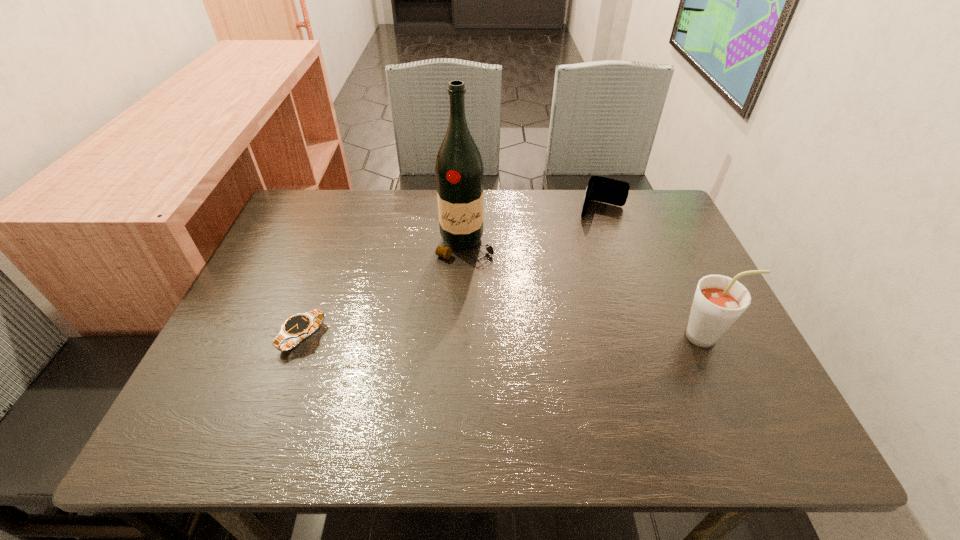
I want to click on free spot on the desktop that is between the shortest object and the second tallest object and is positioned on the surface of the second farthest object, so click(x=467, y=336).

This screenshot has height=540, width=960. Find the location of `vacant spot on the desktop that is between the watch and the third shortest object and is positioned on the outer surface of the wallet`. vacant spot on the desktop that is between the watch and the third shortest object and is positioned on the outer surface of the wallet is located at coordinates (565, 336).